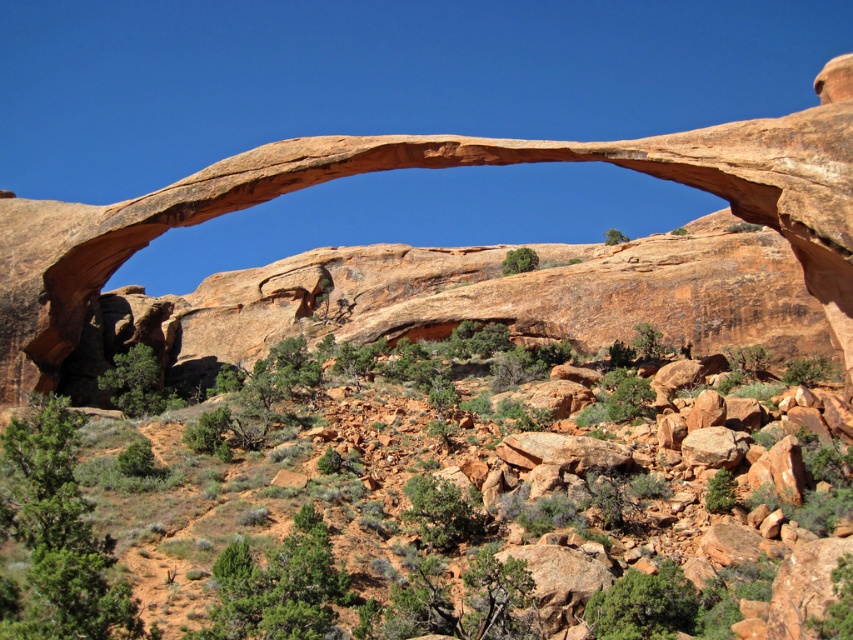
Is point (693, 397) less distant than point (724, 451)?

No, it is not.

Does rustic stone arch at center have a greater height compared to rusty rock at center?

Correct, rustic stone arch at center is much taller as rusty rock at center.

Find the location of a particular element. rustic stone arch at center is located at coordinates (364, 520).

Locate an element on the screen. The image size is (853, 640). rustic stone arch at center is located at coordinates (364, 520).

Which is more to the left, rustic stone arch at center or rustic sandstone arch at center?

rustic stone arch at center is more to the left.

Is rustic stone arch at center below rustic sandstone arch at center?

Correct, rustic stone arch at center is located below rustic sandstone arch at center.

Is point (457, 545) positioned in front of point (4, 276)?

Yes, point (457, 545) is closer to viewer.

The image size is (853, 640). Find the location of `rustic stone arch at center`. rustic stone arch at center is located at coordinates (364, 520).

Is rustic sandstone arch at center closer to the viewer compared to rusty rock at center?

No, it is behind rusty rock at center.

Is point (793, 145) positioned behind point (703, 433)?

Yes.

In order to click on rustic sandstone arch at center in this screenshot , I will do `click(430, 166)`.